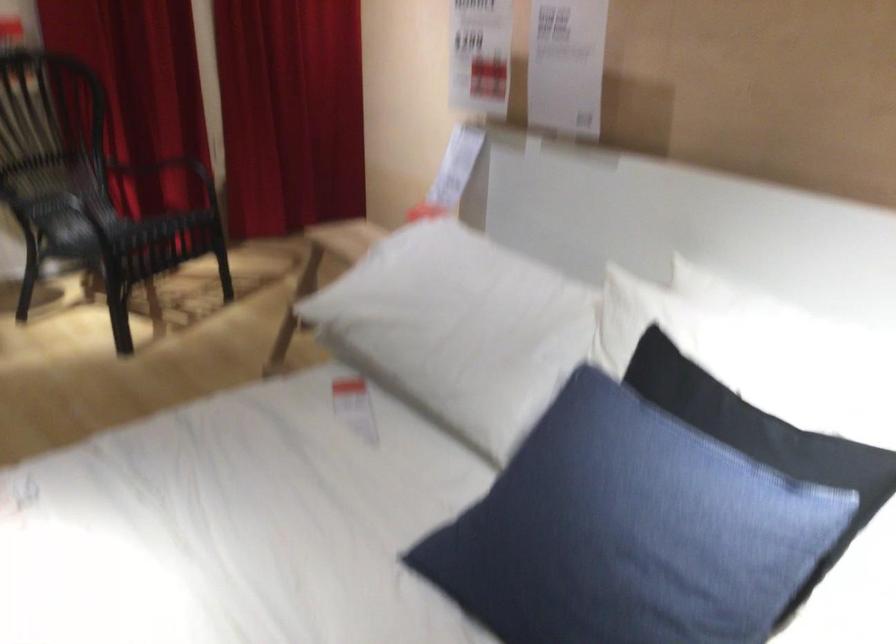
The width and height of the screenshot is (896, 644). I want to click on chair sitting surface, so click(x=110, y=228).